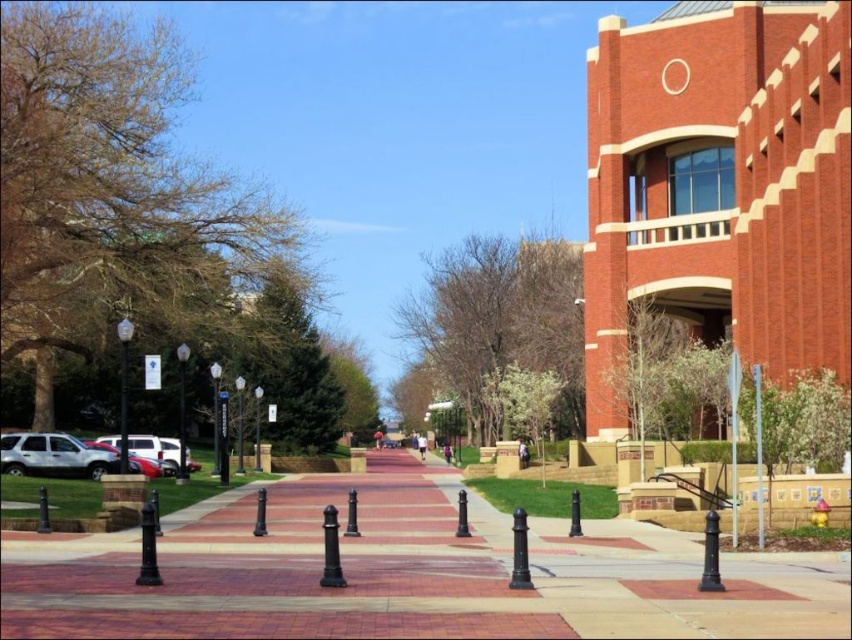
Consider the image. Who is higher up, green leafy tree at center or metallic streetlight at center-left?

Positioned higher is metallic streetlight at center-left.

Looking at this image, which is more to the left, green leafy tree at center or metallic streetlight at center-left?

From the viewer's perspective, metallic streetlight at center-left appears more on the left side.

Between point (344, 413) and point (183, 480), which one is positioned behind?

The point (344, 413) is more distant.

You are a GUI agent. You are given a task and a screenshot of the screen. Output one action in this format:
    pyautogui.click(x=<x>, y=<y>)
    Task: Click on the green leafy tree at center
    The image size is (852, 640).
    Given the screenshot: What is the action you would take?
    pyautogui.click(x=352, y=385)

Is brown leafy tree at left further to camera compared to metallic streetlight at center-left?

Yes, brown leafy tree at left is behind metallic streetlight at center-left.

Between brown leafy tree at left and metallic streetlight at center-left, which one has less height?

metallic streetlight at center-left

Image resolution: width=852 pixels, height=640 pixels. What do you see at coordinates (139, 225) in the screenshot?
I see `brown leafy tree at left` at bounding box center [139, 225].

The image size is (852, 640). Find the location of `brown leafy tree at left`. brown leafy tree at left is located at coordinates (139, 225).

Is brown leafy tree at center bigger than metallic silver suv at left?

Correct, brown leafy tree at center is larger in size than metallic silver suv at left.

Is brown leafy tree at center taller than metallic silver suv at left?

Yes.

Which is behind, point (567, 314) or point (130, 451)?

The point (567, 314) is behind.

Locate an element on the screen. This screenshot has height=640, width=852. brown leafy tree at center is located at coordinates (499, 323).